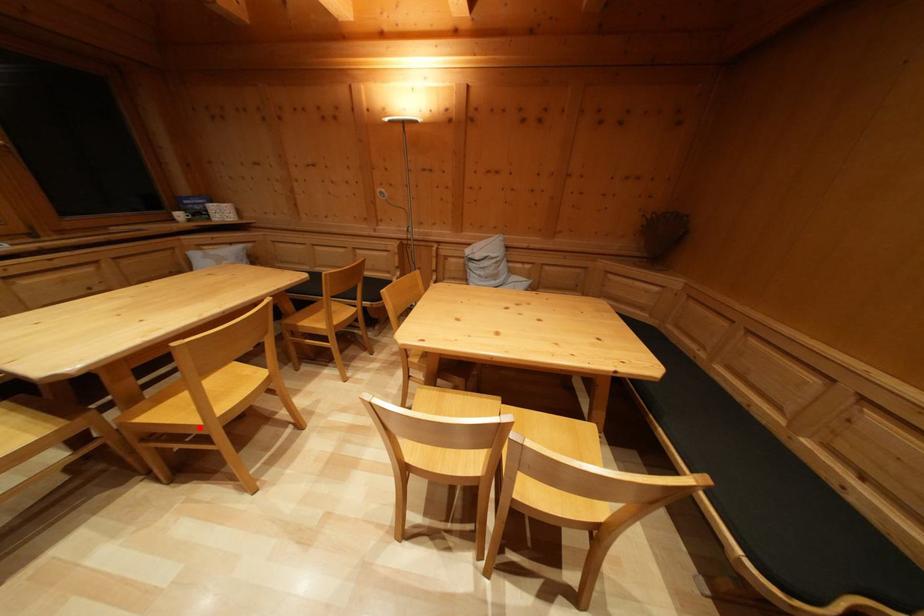
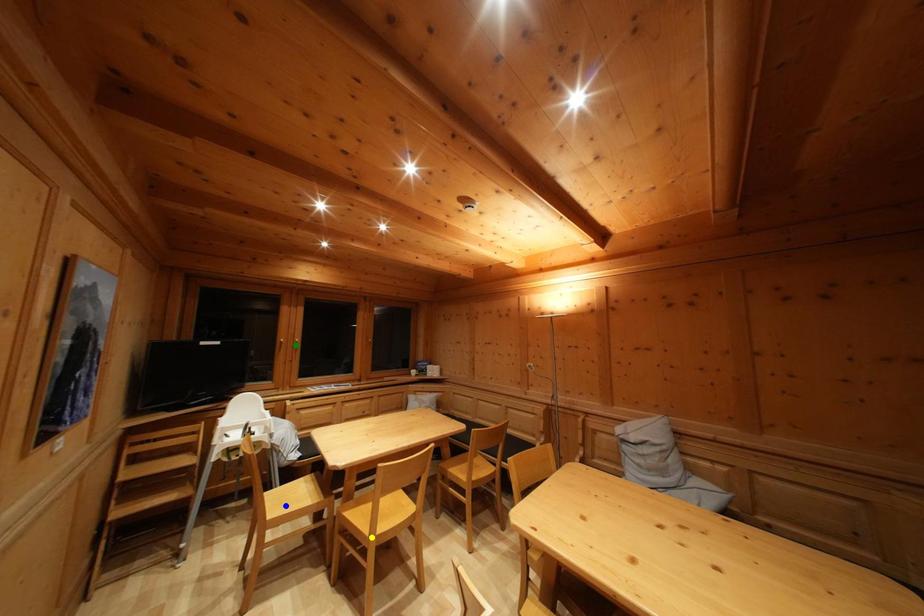
Question: I am providing you with two images of the same scene from different viewpoints. A red point is marked on the first image. You are given multiple points on the second image. Can you choose the point in image 2 that corresponds to the point in image 1?

Choices:
 (A) yellow point
 (B) green point
 (C) blue point

Answer: (A)